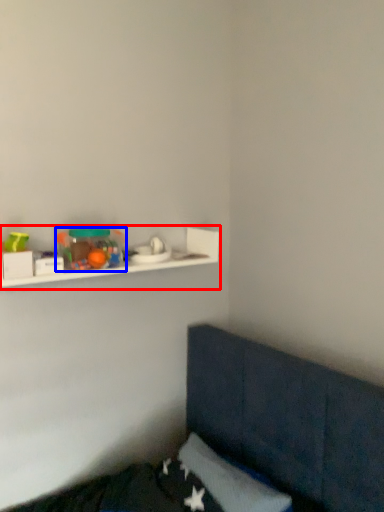
Question: Which object is closer to the camera taking this photo, shelf (highlighted by a red box) or toy (highlighted by a blue box)?

Choices:
 (A) shelf
 (B) toy

Answer: (A)